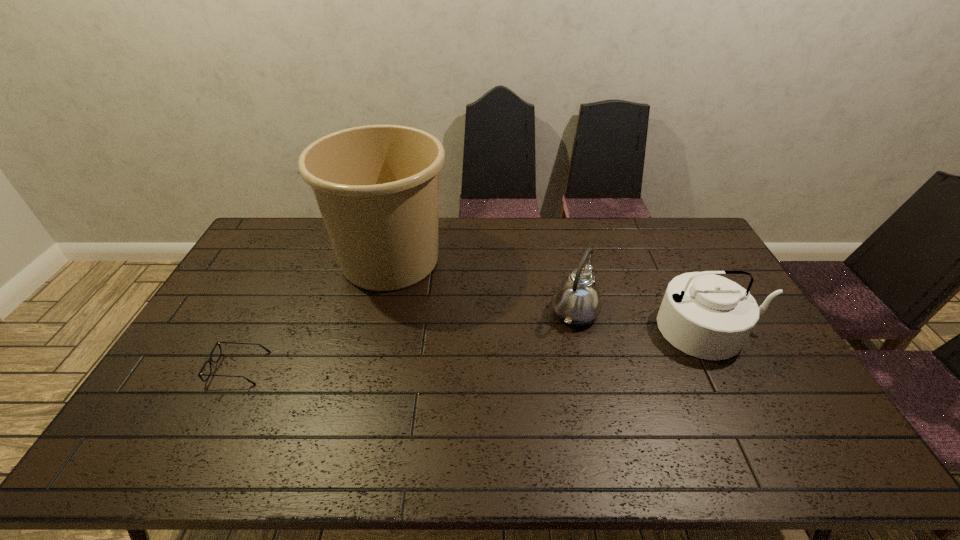
Find the location of `the tallest object`. the tallest object is located at coordinates (377, 186).

You are a GUI agent. You are given a task and a screenshot of the screen. Output one action in this format:
    pyautogui.click(x=<x>, y=<y>)
    Task: Click on the bucket
    
    Given the screenshot: What is the action you would take?
    pyautogui.click(x=377, y=186)

This screenshot has height=540, width=960. What are the coordinates of `the second object from right to left` in the screenshot? It's located at (577, 302).

Find the location of `the right kettle`. the right kettle is located at coordinates (707, 316).

Locate an element on the screen. The width and height of the screenshot is (960, 540). the leftmost object is located at coordinates (210, 360).

This screenshot has height=540, width=960. Identify the location of spectacles. (210, 360).

Where is `free space located 0.330m on the front of the third object from right to left`? free space located 0.330m on the front of the third object from right to left is located at coordinates (358, 388).

The width and height of the screenshot is (960, 540). I want to click on vacant space situated 0.210m on the right of the third object from left to right, so click(665, 312).

Locate an element on the screen. free space located on the spout of the right kettle is located at coordinates (756, 418).

The width and height of the screenshot is (960, 540). I want to click on blank space located with the lenses facing outward on the shortest object, so click(x=407, y=368).